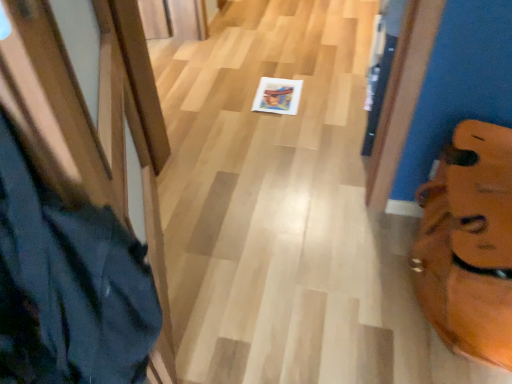
This screenshot has width=512, height=384. What do you see at coordinates (68, 285) in the screenshot?
I see `matte black shoulder bag at left` at bounding box center [68, 285].

Find the location of a particular element. matte black shoulder bag at left is located at coordinates (68, 285).

Measure the distance between matte black shoulder bag at left and camera.

matte black shoulder bag at left and camera are 16.50 inches apart.

I want to click on matte black shoulder bag at left, so click(x=68, y=285).